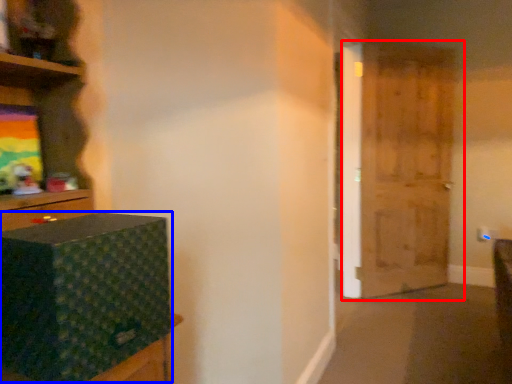
Question: Which point is further to the camera, door (highlighted by a red box) or box (highlighted by a blue box)?

Choices:
 (A) door
 (B) box

Answer: (A)